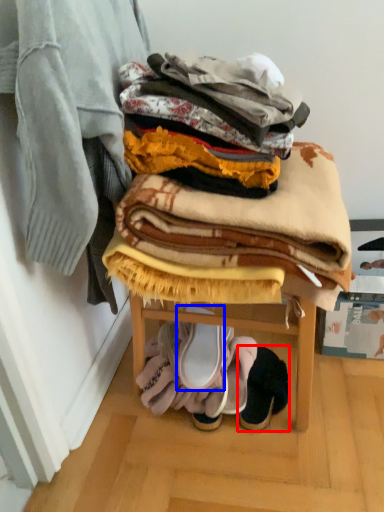
Question: Which object is closer to the camera taking this photo, footwear (highlighted by a red box) or footwear (highlighted by a blue box)?

Choices:
 (A) footwear
 (B) footwear

Answer: (B)